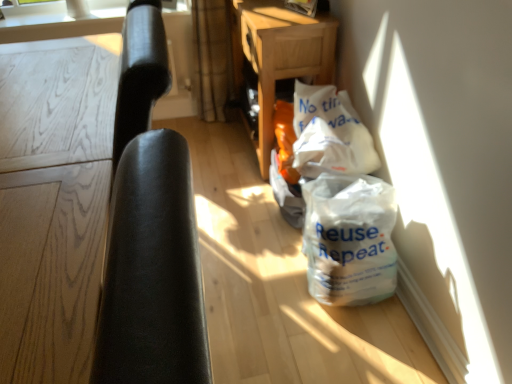
Question: Is white paper bag at center positioned in front of white matte plastic bag at lower right?

Choices:
 (A) yes
 (B) no

Answer: (B)

Question: From the image's perspective, would you say white paper bag at center is positioned over white matte plastic bag at lower right?

Choices:
 (A) no
 (B) yes

Answer: (B)

Question: Can you confirm if white paper bag at center is wider than white matte plastic bag at lower right?

Choices:
 (A) yes
 (B) no

Answer: (B)

Question: From a real-world perspective, is white paper bag at center located beneath white matte plastic bag at lower right?

Choices:
 (A) no
 (B) yes

Answer: (A)

Question: Is white matte plastic bag at lower right at the back of white paper bag at center?

Choices:
 (A) no
 (B) yes

Answer: (A)

Question: Is white paper bag at center to the left of white matte plastic bag at lower right from the viewer's perspective?

Choices:
 (A) yes
 (B) no

Answer: (A)

Question: Is white paper bag at center closer to the viewer compared to black leather chair at left?

Choices:
 (A) yes
 (B) no

Answer: (B)

Question: Is white paper bag at center facing away from black leather chair at left?

Choices:
 (A) no
 (B) yes

Answer: (A)

Question: Is white paper bag at center beside black leather chair at left?

Choices:
 (A) no
 (B) yes

Answer: (A)

Question: Is white paper bag at center not inside black leather chair at left?

Choices:
 (A) yes
 (B) no

Answer: (A)

Question: Considering the relative sizes of white paper bag at center and black leather chair at left in the image provided, is white paper bag at center wider than black leather chair at left?

Choices:
 (A) no
 (B) yes

Answer: (A)

Question: Is white paper bag at center not near black leather chair at left?

Choices:
 (A) yes
 (B) no

Answer: (A)

Question: From a real-world perspective, is black leather chair at left over white paper bag at center?

Choices:
 (A) no
 (B) yes

Answer: (B)